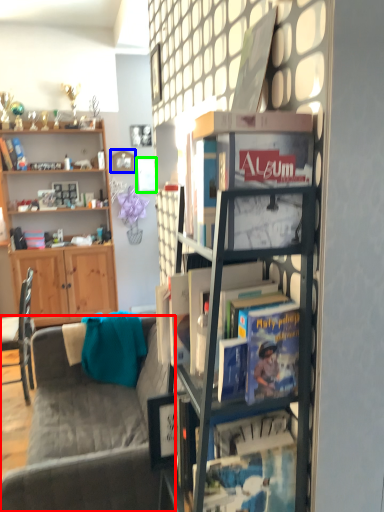
Question: Which is farther away from studio couch (highlighted by a red box)? picture frame (highlighted by a blue box) or picture frame (highlighted by a green box)?

Choices:
 (A) picture frame
 (B) picture frame

Answer: (A)